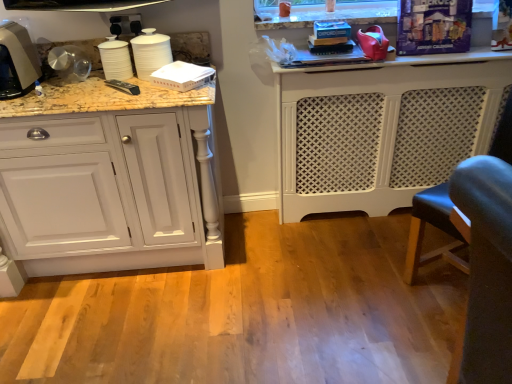
Question: From the image's perspective, is metallic silver kettle at left located above white glossy cups at upper left, the 2th appliance positioned from the left?

Choices:
 (A) no
 (B) yes

Answer: (A)

Question: Is metallic silver kettle at left facing towards white glossy cups at upper left, marked as the third appliance in a right-to-left arrangement?

Choices:
 (A) no
 (B) yes

Answer: (A)

Question: Can you confirm if metallic silver kettle at left is bigger than white glossy cups at upper left, marked as the third appliance in a right-to-left arrangement?

Choices:
 (A) yes
 (B) no

Answer: (A)

Question: Would you say metallic silver kettle at left is outside white glossy cups at upper left, the 2th appliance positioned from the left?

Choices:
 (A) no
 (B) yes

Answer: (B)

Question: Does metallic silver kettle at left appear on the right side of white glossy cups at upper left, the 2th appliance positioned from the left?

Choices:
 (A) yes
 (B) no

Answer: (B)

Question: Considering the positions of point (164, 36) and point (209, 79), is point (164, 36) closer or farther from the camera than point (209, 79)?

Choices:
 (A) farther
 (B) closer

Answer: (A)

Question: Looking at their shapes, would you say white glossy cups at upper left, marked as the third appliance in a right-to-left arrangement, is wider or thinner than white paper napkin at upper left, the second appliance in the right-to-left sequence?

Choices:
 (A) thin
 (B) wide

Answer: (A)

Question: Considering the relative positions of white glossy cups at upper left, marked as the third appliance in a right-to-left arrangement, and white paper napkin at upper left, the 3th appliance viewed from the left, in the image provided, is white glossy cups at upper left, marked as the third appliance in a right-to-left arrangement, to the left or to the right of white paper napkin at upper left, the 3th appliance viewed from the left,?

Choices:
 (A) left
 (B) right

Answer: (A)

Question: Considering their positions, is white glossy cups at upper left, marked as the third appliance in a right-to-left arrangement, located in front of or behind white paper napkin at upper left, the 3th appliance viewed from the left?

Choices:
 (A) behind
 (B) front

Answer: (A)

Question: Based on their positions, is white glossy cups at upper left, the 2th appliance positioned from the left, located to the left or right of metallic silver kettle at left?

Choices:
 (A) left
 (B) right

Answer: (B)

Question: Is point (168, 44) positioned closer to the camera than point (31, 74)?

Choices:
 (A) closer
 (B) farther

Answer: (B)

Question: From the image's perspective, is white glossy cups at upper left, the 2th appliance positioned from the left, above or below metallic silver kettle at left?

Choices:
 (A) below
 (B) above

Answer: (B)

Question: From a real-world perspective, relative to metallic silver kettle at left, is white glossy cups at upper left, marked as the third appliance in a right-to-left arrangement, vertically above or below?

Choices:
 (A) above
 (B) below

Answer: (B)

Question: Is point (362, 36) closer or farther from the camera than point (118, 66)?

Choices:
 (A) farther
 (B) closer

Answer: (A)

Question: In terms of height, does rubberized red shoe at upper right, which is the 4th appliance from left to right, look taller or shorter compared to white matte cups at left, marked as the fourth appliance in a right-to-left arrangement?

Choices:
 (A) short
 (B) tall

Answer: (A)